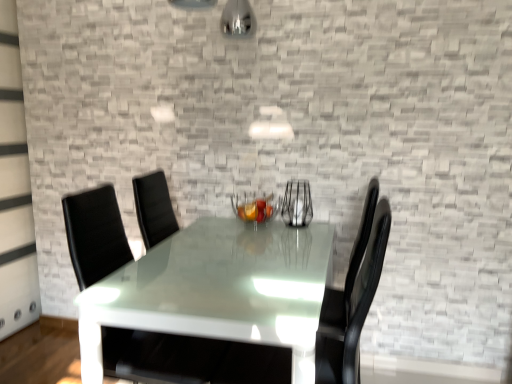
The width and height of the screenshot is (512, 384). What are the coordinates of `vacant point above glossy white table at center (from a real-world perspective)` in the screenshot? It's located at (231, 256).